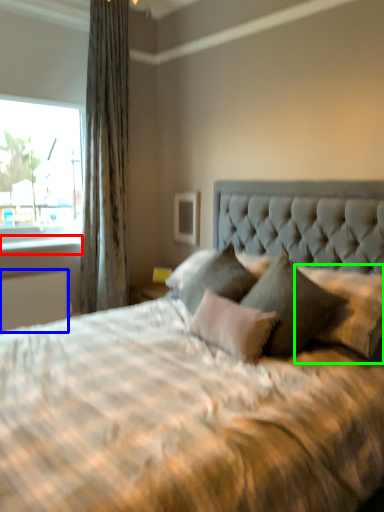
Question: Based on their relative distances, which object is farther from window sill (highlighted by a red box)? Choose from radiator (highlighted by a blue box) and pillow (highlighted by a green box).

Choices:
 (A) radiator
 (B) pillow

Answer: (B)